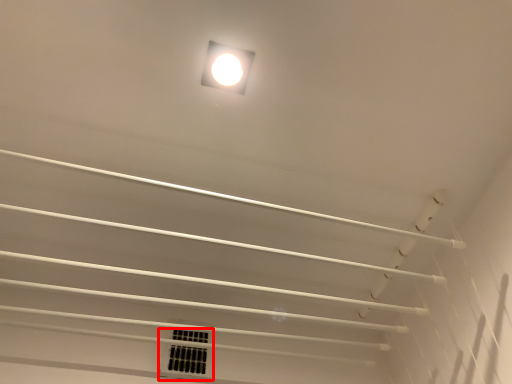
Question: From the image, what is the correct spatial relationship of window (annotated by the red box) in relation to lamp?

Choices:
 (A) left
 (B) right

Answer: (A)